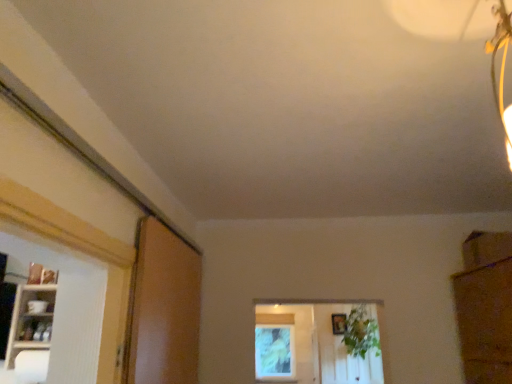
Question: From the image's perspective, would you say green leafy plant at center is shown under wooden picture frame at center?

Choices:
 (A) no
 (B) yes

Answer: (A)

Question: Are green leafy plant at center and wooden picture frame at center located far from each other?

Choices:
 (A) yes
 (B) no

Answer: (B)

Question: Is green leafy plant at center thinner than wooden picture frame at center?

Choices:
 (A) yes
 (B) no

Answer: (B)

Question: From a real-world perspective, is green leafy plant at center over wooden picture frame at center?

Choices:
 (A) yes
 (B) no

Answer: (B)

Question: Does green leafy plant at center turn towards wooden picture frame at center?

Choices:
 (A) yes
 (B) no

Answer: (B)

Question: Does green leafy plant at center lie in front of wooden picture frame at center?

Choices:
 (A) no
 (B) yes

Answer: (B)

Question: Does green leafy plant at center come in front of white glossy shelf at left?

Choices:
 (A) yes
 (B) no

Answer: (B)

Question: Is white glossy shelf at left located within green leafy plant at center?

Choices:
 (A) yes
 (B) no

Answer: (B)

Question: Would you say green leafy plant at center is outside white glossy shelf at left?

Choices:
 (A) yes
 (B) no

Answer: (A)

Question: Considering the relative sizes of green leafy plant at center and white glossy shelf at left in the image provided, is green leafy plant at center bigger than white glossy shelf at left?

Choices:
 (A) no
 (B) yes

Answer: (B)

Question: From the image's perspective, is green leafy plant at center below white glossy shelf at left?

Choices:
 (A) no
 (B) yes

Answer: (B)

Question: Considering the relative sizes of green leafy plant at center and white glossy shelf at left in the image provided, is green leafy plant at center smaller than white glossy shelf at left?

Choices:
 (A) yes
 (B) no

Answer: (B)

Question: Does white glossy shelf at left have a larger size compared to green leafy plant at center?

Choices:
 (A) yes
 (B) no

Answer: (B)